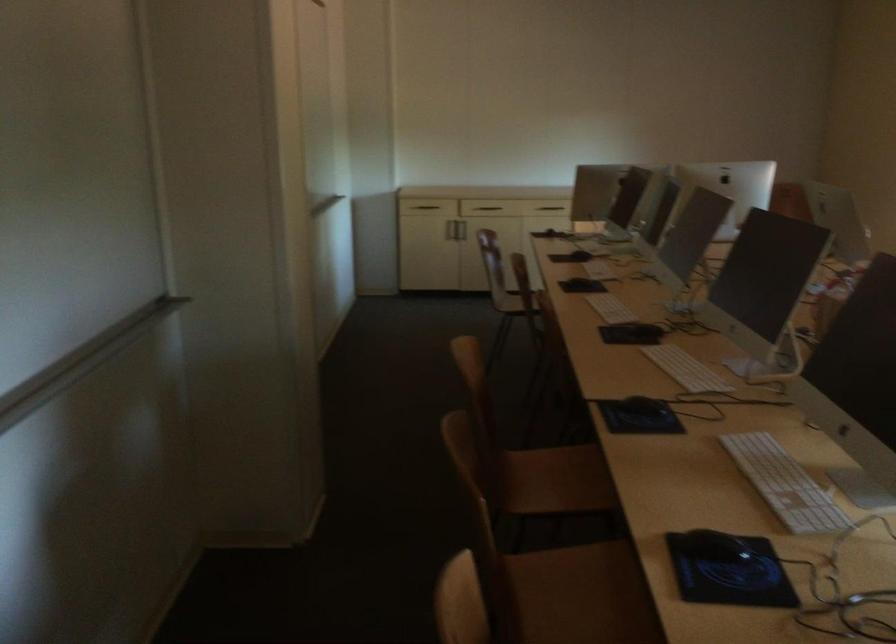
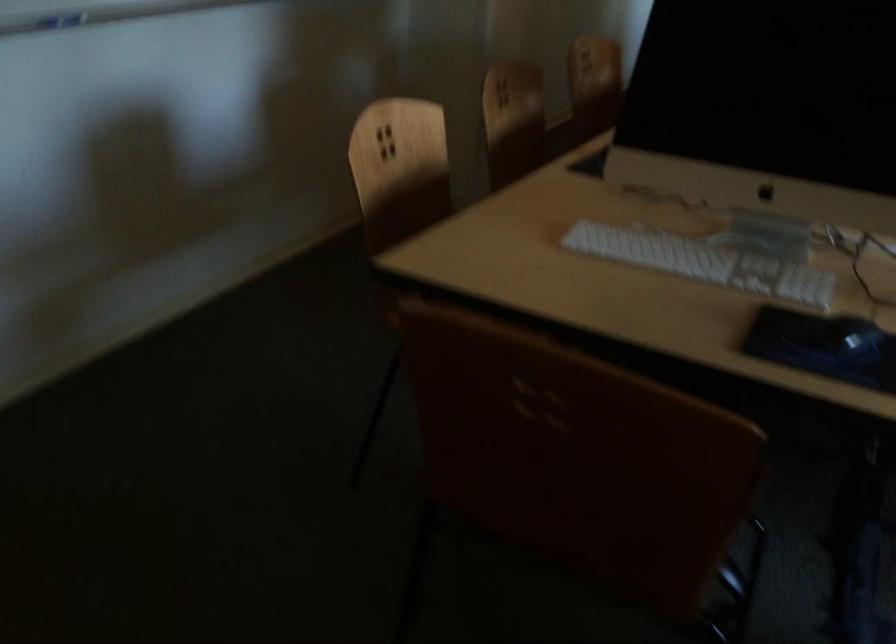
Question: I am providing you with two images of the same scene from different viewpoints. Please identify which objects are invisible in image2.

Choices:
 (A) wooden chair sitting surface
 (B) white toilet paper roll
 (C) black computer mouse
 (D) white keyboard

Answer: (A)